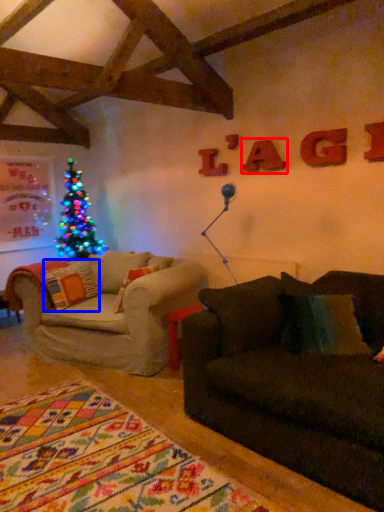
Question: Which object appears farthest to the camera in this image, letter (highlighted by a red box) or pillow (highlighted by a blue box)?

Choices:
 (A) letter
 (B) pillow

Answer: (B)